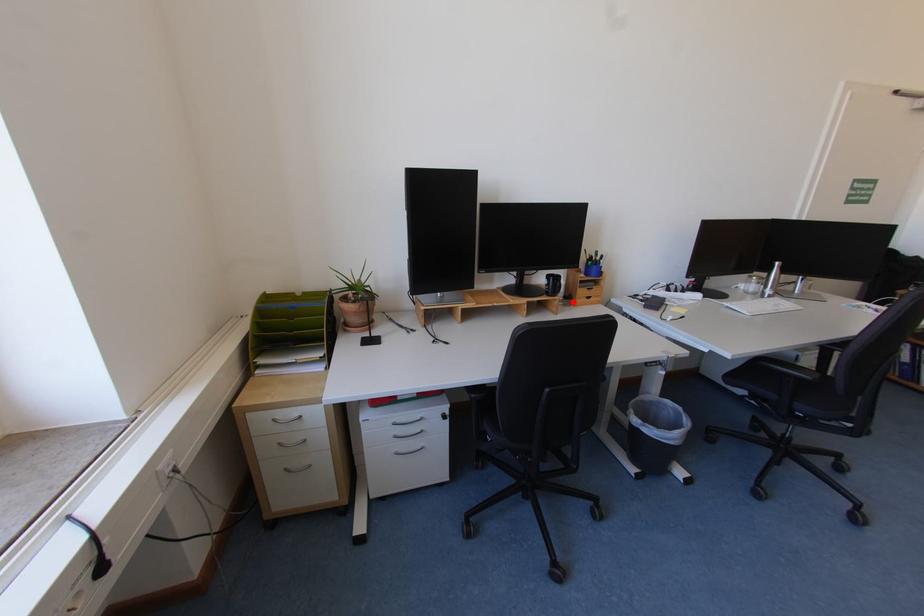
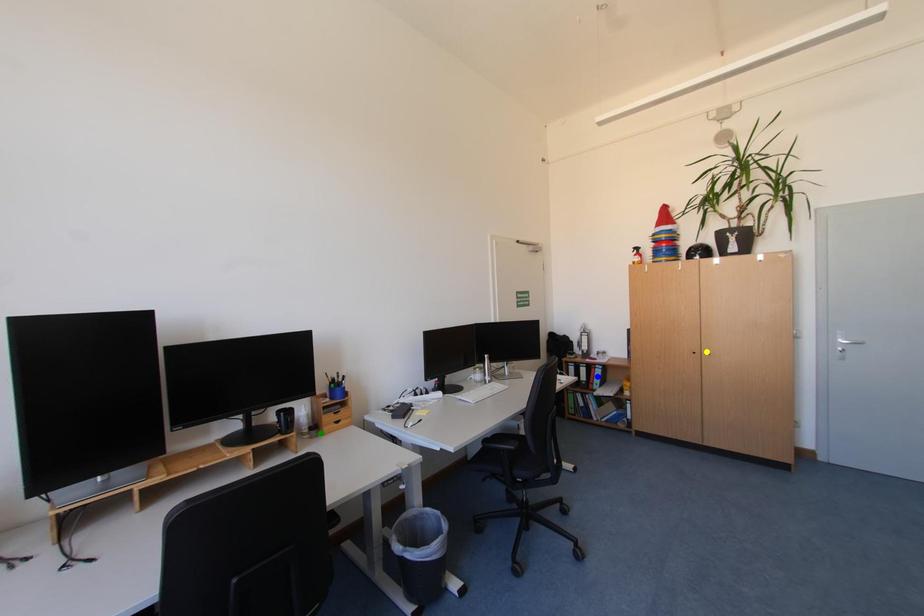
Question: I am providing you with two images of the same scene from different viewpoints. A red point is marked on the first image. You are given multiple points on the second image. Which point in image 2 represents the same 3d spot as the red point in image 1?

Choices:
 (A) blue point
 (B) yellow point
 (C) green point

Answer: (C)